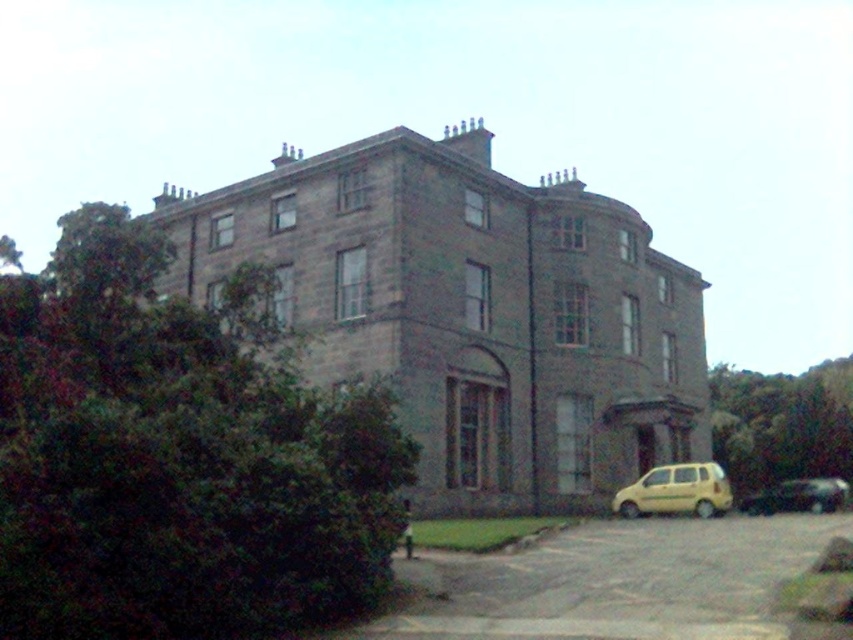
Question: Is yellow matte van at lower right positioned at the back of shiny black car at lower right?

Choices:
 (A) yes
 (B) no

Answer: (B)

Question: Among these points, which one is nearest to the camera?

Choices:
 (A) (647, 506)
 (B) (756, 506)

Answer: (A)

Question: Which of the following is the closest to the observer?

Choices:
 (A) (630, 492)
 (B) (816, 483)

Answer: (A)

Question: Does yellow matte van at lower right appear on the right side of shiny black car at lower right?

Choices:
 (A) yes
 (B) no

Answer: (B)

Question: From the image, what is the correct spatial relationship of yellow matte van at lower right in relation to shiny black car at lower right?

Choices:
 (A) above
 (B) below

Answer: (A)

Question: Which point appears farthest from the camera in this image?

Choices:
 (A) (845, 492)
 (B) (709, 474)

Answer: (A)